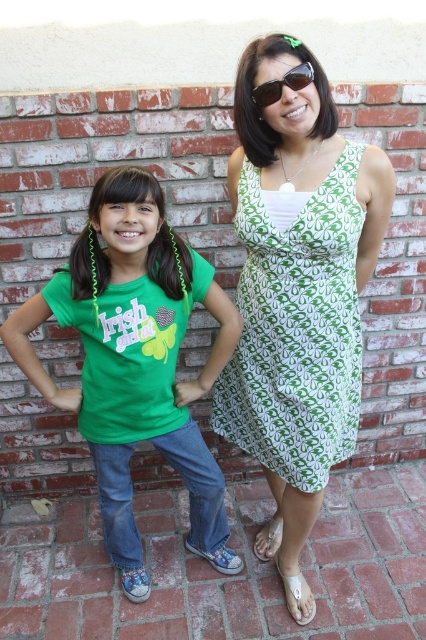
Question: Considering the relative positions of green matte t-shirt at left and sunglasses at upper center in the image provided, where is green matte t-shirt at left located with respect to sunglasses at upper center?

Choices:
 (A) below
 (B) above

Answer: (A)

Question: Does green matte t-shirt at left have a greater width compared to sunglasses at upper center?

Choices:
 (A) no
 (B) yes

Answer: (B)

Question: Which object is positioned closest to the sunglasses at upper center?

Choices:
 (A) green matte t-shirt at left
 (B) green printed dress at center

Answer: (B)

Question: Considering the real-world distances, which object is closest to the green printed dress at center?

Choices:
 (A) sunglasses at upper center
 (B) green matte t-shirt at left

Answer: (B)

Question: Can you confirm if green printed dress at center is bigger than sunglasses at upper center?

Choices:
 (A) yes
 (B) no

Answer: (A)

Question: Among these objects, which one is farthest from the camera?

Choices:
 (A) green matte t-shirt at left
 (B) green printed dress at center

Answer: (A)